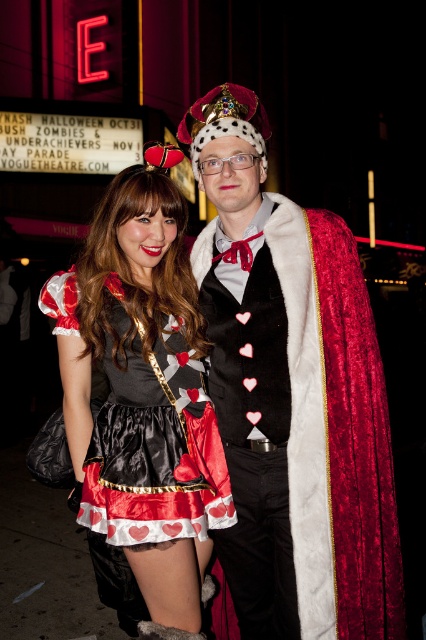
You are a photographer at the event and need to capture a photo of both the satin dress at center and the velvet red cape at center. Based on their positions, which one should you focus on first to ensure both are in frame?

The satin dress at center is positioned on the left side of the velvet red cape at center, so you should focus on the velvet red cape at center first to ensure both are in frame.

You are standing in front of the theater and notice a point at coordinates [293,396]. Based on the scene description, what object or feature does this point most likely represent?

The point at coordinates [293,396] corresponds to the velvet heart patterned dress at center.

You are standing at the point marked by coordinates point (299, 605). You want to walk to the entrance of the venue, which is located 20 feet away from your current position. Considering the distance between you and the entrance, will you be able to reach it without moving more than 19.03 feet?

The distance between you and the entrance is 19.03 feet, which is less than the 20 feet you are willing to walk. Therefore, you can reach the entrance without exceeding the 20 feet limit.